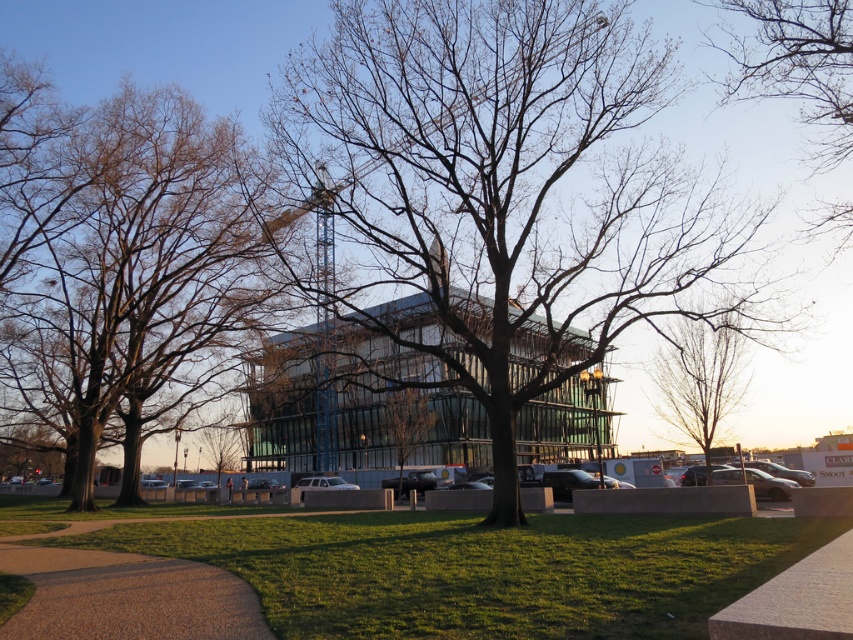
You are a landscape architect designing a new park. You notice two features in the scene, the bare branches at center and the brown smooth tree at center. Which one is positioned lower in the image?

The bare branches at center is located below brown smooth tree at center, so it is positioned lower in the image.

You are standing at the point labeled as point (483, 570) in the image. Looking around, what can you see immediately around you?

You are standing on green grass at lower center, as indicated by point (483, 570).